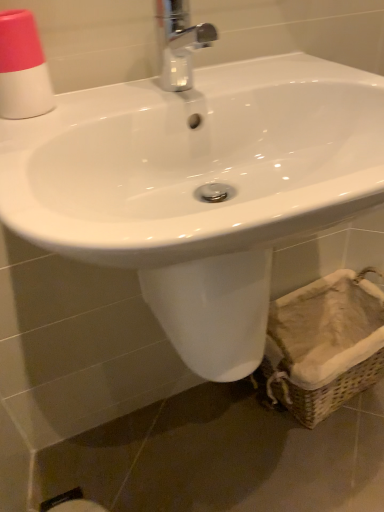
What do you see at coordinates (295, 29) in the screenshot?
I see `white glossy sink at center` at bounding box center [295, 29].

Describe the element at coordinates (179, 42) in the screenshot. I see `chrome metallic faucet at upper center` at that location.

This screenshot has height=512, width=384. Identify the location of woven beige basket at lower right. (324, 345).

In order to click on white glossy sink at center in this screenshot , I will do `click(295, 29)`.

Considering the relative sizes of white glossy sink at center and chrome metallic faucet at upper center in the image provided, is white glossy sink at center taller than chrome metallic faucet at upper center?

Yes.

Which is more to the left, white glossy sink at center or chrome metallic faucet at upper center?

chrome metallic faucet at upper center.

From the image's perspective, is white glossy sink at center above chrome metallic faucet at upper center?

No, from the image's perspective, white glossy sink at center is not over chrome metallic faucet at upper center.

Considering the sizes of objects white glossy sink at center and chrome metallic faucet at upper center in the image provided, who is bigger, white glossy sink at center or chrome metallic faucet at upper center?

white glossy sink at center is bigger.

Can you confirm if pink matte cup at upper left is wider than white glossy sink at center?

In fact, pink matte cup at upper left might be narrower than white glossy sink at center.

Is pink matte cup at upper left oriented away from white glossy sink at center?

No, pink matte cup at upper left is not facing away from white glossy sink at center.

Between pink matte cup at upper left and white glossy sink at center, which one appears on the right side from the viewer's perspective?

white glossy sink at center is more to the right.

Is pink matte cup at upper left oriented away from woven beige basket at lower right?

No.

From the image's perspective, which one is positioned lower, pink matte cup at upper left or woven beige basket at lower right?

woven beige basket at lower right appears lower in the image.

Does point (41, 100) come in front of point (378, 323)?

Yes, point (41, 100) is in front of point (378, 323).

Considering the sizes of pink matte cup at upper left and woven beige basket at lower right in the image, is pink matte cup at upper left taller or shorter than woven beige basket at lower right?

Considering their sizes, pink matte cup at upper left has less height than woven beige basket at lower right.

Between woven beige basket at lower right and chrome metallic faucet at upper center, which one is positioned behind?

woven beige basket at lower right is further away from the camera.

From a real-world perspective, is woven beige basket at lower right positioned over chrome metallic faucet at upper center based on gravity?

No, from a real-world perspective, woven beige basket at lower right is not over chrome metallic faucet at upper center

Looking at this image, is woven beige basket at lower right bigger than chrome metallic faucet at upper center?

Yes, woven beige basket at lower right is bigger than chrome metallic faucet at upper center.

Considering the sizes of objects white glossy sink at center and woven beige basket at lower right in the image provided, who is smaller, white glossy sink at center or woven beige basket at lower right?

woven beige basket at lower right is smaller.

Is white glossy sink at center facing towards woven beige basket at lower right?

No, white glossy sink at center is not oriented towards woven beige basket at lower right.

Which object is closer to the camera taking this photo, white glossy sink at center or woven beige basket at lower right?

white glossy sink at center.

Can you confirm if white glossy sink at center is taller than woven beige basket at lower right?

Correct, white glossy sink at center is much taller as woven beige basket at lower right.

Does chrome metallic faucet at upper center have a lesser height compared to pink matte cup at upper left?

No, chrome metallic faucet at upper center is not shorter than pink matte cup at upper left.

Considering the relative sizes of chrome metallic faucet at upper center and pink matte cup at upper left in the image provided, is chrome metallic faucet at upper center thinner than pink matte cup at upper left?

No.

Looking at this image, how many degrees apart are the facing directions of chrome metallic faucet at upper center and pink matte cup at upper left?

The angle between the facing direction of chrome metallic faucet at upper center and the facing direction of pink matte cup at upper left is 1.35 degrees.

Which object is positioned more to the left, white glossy sink at center or pink matte cup at upper left?

pink matte cup at upper left is more to the left.

Does white glossy sink at center turn towards pink matte cup at upper left?

No, white glossy sink at center is not turned towards pink matte cup at upper left.

Consider the image. Is white glossy sink at center inside the boundaries of pink matte cup at upper left, or outside?

white glossy sink at center exists outside the volume of pink matte cup at upper left.

Is the surface of white glossy sink at center in direct contact with pink matte cup at upper left?

No, white glossy sink at center is not making contact with pink matte cup at upper left.

Identify the location of sink below the chrome metallic faucet at upper center (from the image's perspective). (295, 29).

The height and width of the screenshot is (512, 384). I want to click on toiletry that appears above the white glossy sink at center (from a real-world perspective), so click(23, 68).

Which object lies nearer to the anchor point white glossy sink at center, chrome metallic faucet at upper center or woven beige basket at lower right?

Based on the image, chrome metallic faucet at upper center appears to be nearer to white glossy sink at center.

Which object lies nearer to the anchor point chrome metallic faucet at upper center, white glossy sink at center or woven beige basket at lower right?

white glossy sink at center is positioned closer to the anchor chrome metallic faucet at upper center.

Considering their positions, is pink matte cup at upper left positioned further to white glossy sink at center than chrome metallic faucet at upper center?

pink matte cup at upper left.

Considering their positions, is pink matte cup at upper left positioned further to woven beige basket at lower right than chrome metallic faucet at upper center?

Among the two, pink matte cup at upper left is located further to woven beige basket at lower right.

Looking at the image, which one is located closer to chrome metallic faucet at upper center, pink matte cup at upper left or white glossy sink at center?

white glossy sink at center lies closer to chrome metallic faucet at upper center than the other object.

Based on their spatial positions, is pink matte cup at upper left or white glossy sink at center closer to woven beige basket at lower right?

white glossy sink at center is closer to woven beige basket at lower right.

When comparing their distances from white glossy sink at center, does pink matte cup at upper left or woven beige basket at lower right seem further?

woven beige basket at lower right.

When comparing their distances from white glossy sink at center, does woven beige basket at lower right or pink matte cup at upper left seem further?

Based on the image, woven beige basket at lower right appears to be further to white glossy sink at center.

The width and height of the screenshot is (384, 512). Identify the location of toiletry between chrome metallic faucet at upper center and white glossy sink at center in the up-down direction. (23, 68).

Find the location of a particular element. Image resolution: width=384 pixels, height=512 pixels. sink located between pink matte cup at upper left and woven beige basket at lower right in the left-right direction is located at coordinates (295, 29).

This screenshot has height=512, width=384. I want to click on tap located between white glossy sink at center and woven beige basket at lower right in the depth direction, so click(179, 42).

Find the location of a particular element. toiletry between chrome metallic faucet at upper center and woven beige basket at lower right from top to bottom is located at coordinates (23, 68).